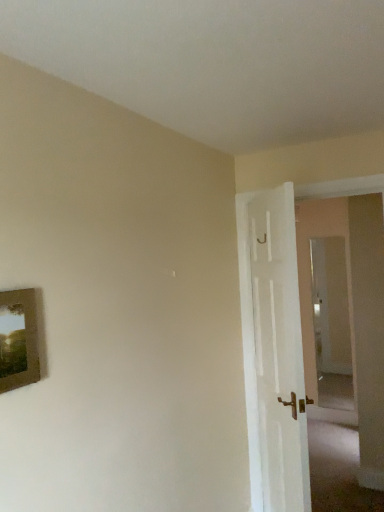
Question: Does wooden picture frame at left appear on the right side of transparent glass door at right?

Choices:
 (A) no
 (B) yes

Answer: (A)

Question: Is wooden picture frame at left bigger than transparent glass door at right?

Choices:
 (A) yes
 (B) no

Answer: (B)

Question: Is wooden picture frame at left not within transparent glass door at right?

Choices:
 (A) no
 (B) yes

Answer: (B)

Question: From a real-world perspective, is wooden picture frame at left over transparent glass door at right?

Choices:
 (A) no
 (B) yes

Answer: (B)

Question: Are wooden picture frame at left and transparent glass door at right far apart?

Choices:
 (A) no
 (B) yes

Answer: (B)

Question: Is wooden picture frame at left wider than transparent glass door at right?

Choices:
 (A) yes
 (B) no

Answer: (A)

Question: Can you confirm if wooden picture frame at left is wider than white wooden door at right?

Choices:
 (A) yes
 (B) no

Answer: (B)

Question: From the image's perspective, is wooden picture frame at left under white wooden door at right?

Choices:
 (A) no
 (B) yes

Answer: (A)

Question: From the image's perspective, is wooden picture frame at left above white wooden door at right?

Choices:
 (A) no
 (B) yes

Answer: (B)

Question: Is wooden picture frame at left facing away from white wooden door at right?

Choices:
 (A) yes
 (B) no

Answer: (B)

Question: Considering the relative sizes of wooden picture frame at left and white wooden door at right in the image provided, is wooden picture frame at left taller than white wooden door at right?

Choices:
 (A) yes
 (B) no

Answer: (B)

Question: From a real-world perspective, is wooden picture frame at left under white wooden door at right?

Choices:
 (A) yes
 (B) no

Answer: (B)

Question: Considering the relative positions of transparent glass door at right and wooden picture frame at left in the image provided, is transparent glass door at right to the right of wooden picture frame at left from the viewer's perspective?

Choices:
 (A) no
 (B) yes

Answer: (B)